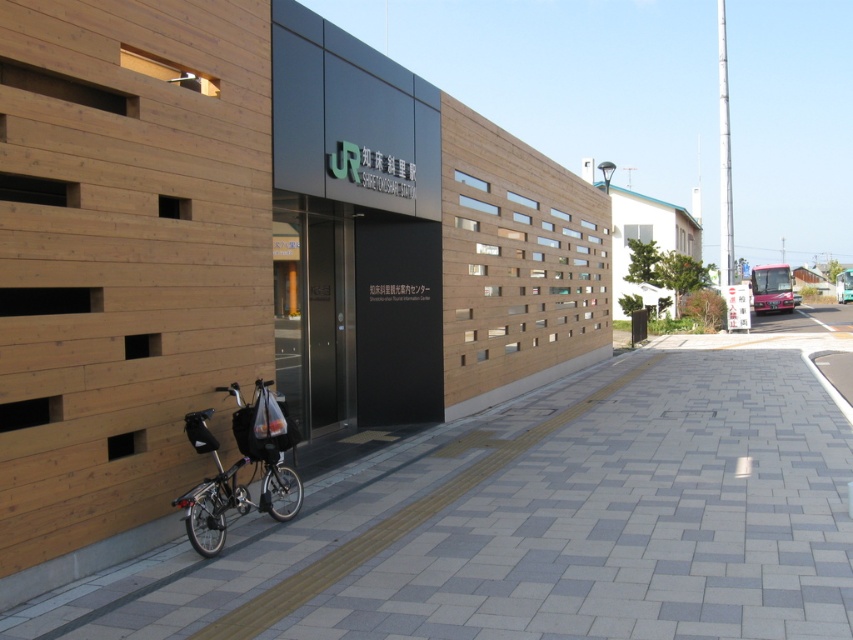
Between gray concrete pavement at center and shiny black bicycle at lower left, which one appears on the left side from the viewer's perspective?

From the viewer's perspective, shiny black bicycle at lower left appears more on the left side.

Who is more distant from viewer, (730,557) or (212,541)?

Point (212,541)

Who is more distant from viewer, (757,339) or (231,484)?

Point (757,339)

Locate an element on the screen. gray concrete pavement at center is located at coordinates (538, 522).